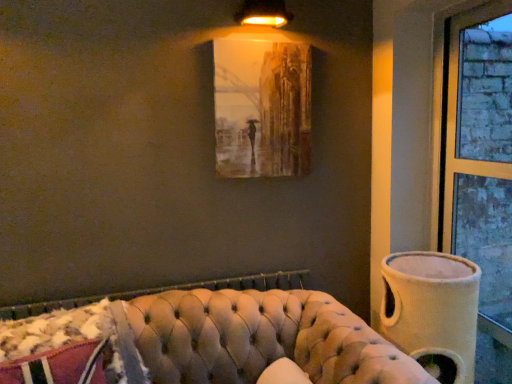
Question: Considering their positions, is matte gold lampshade at upper center located in front of or behind beige fabric vase at right?

Choices:
 (A) behind
 (B) front

Answer: (A)

Question: From the image's perspective, is matte gold lampshade at upper center positioned above or below beige fabric vase at right?

Choices:
 (A) above
 (B) below

Answer: (A)

Question: Which object is positioned closest to the tufted leather couch at lower center?

Choices:
 (A) brick textured window at right
 (B) matte gold lampshade at upper center
 (C) matte brown painting at upper center
 (D) beige fabric vase at right

Answer: (D)

Question: Which is farther from the brick textured window at right?

Choices:
 (A) tufted leather couch at lower center
 (B) matte brown painting at upper center
 (C) matte gold lampshade at upper center
 (D) beige fabric vase at right

Answer: (C)